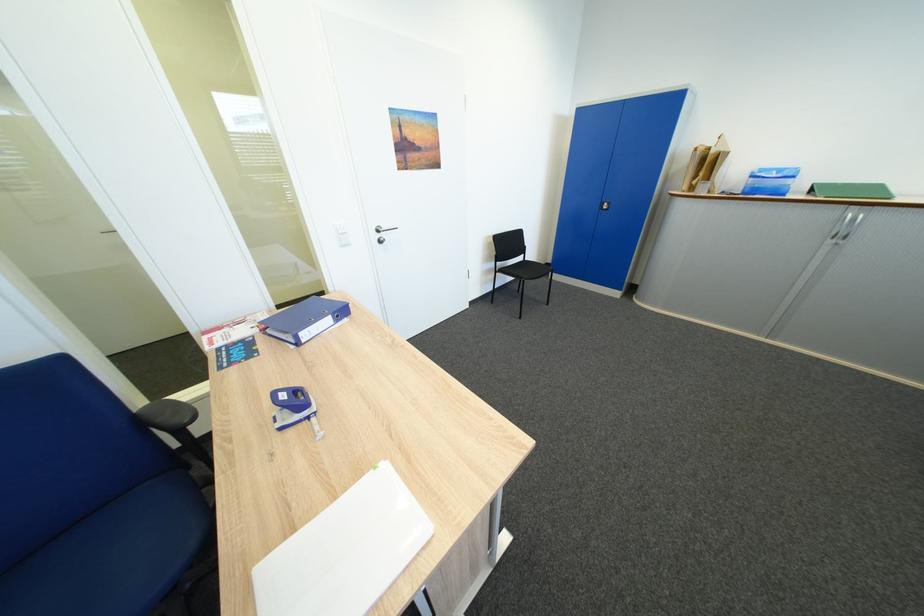
The image size is (924, 616). What are the coordinates of `blue hole punch` in the screenshot? It's located at (294, 408).